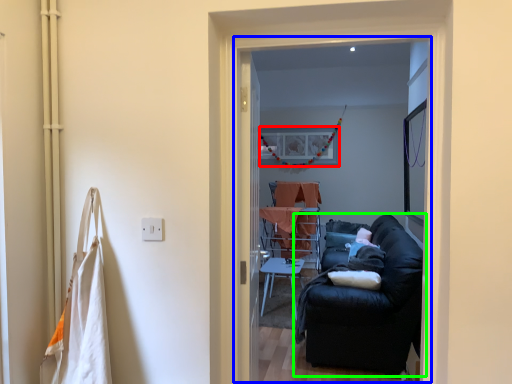
Question: Which object is positioned closest to picture frame (highlighted by a red box)? Select from screen door (highlighted by a blue box) and studio couch (highlighted by a green box).

Choices:
 (A) screen door
 (B) studio couch

Answer: (A)